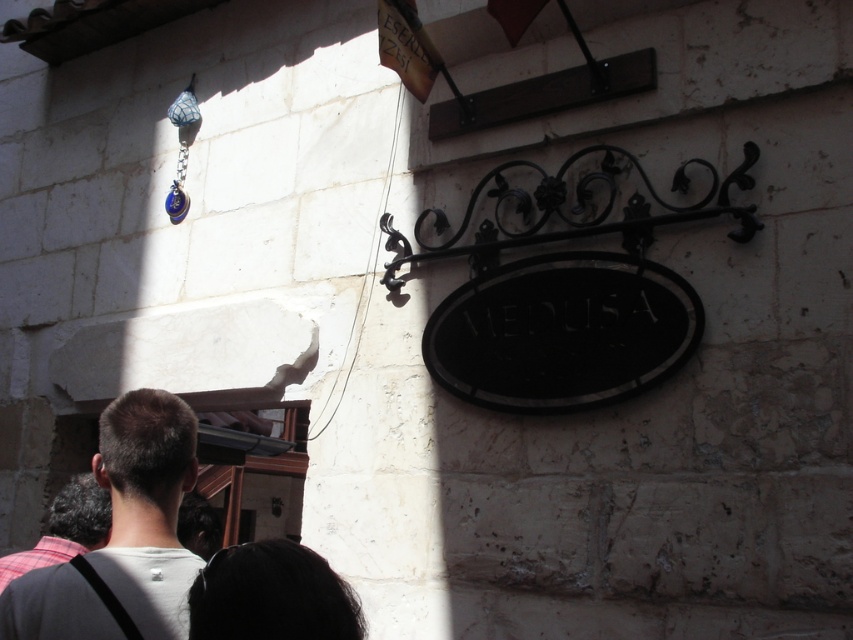
You are an artist observing the building exterior and want to paint the scene. You have two shirts in your bag, the white matte shirt at lower left and the plaid fabric shirt at lower left. Which shirt should you choose to wear if you want to cover more of your body?

The white matte shirt at lower left is larger in size than the plaid fabric shirt at lower left, so you should choose the white matte shirt at lower left to cover more of your body.

You are a photographer taking a portrait of a person standing in front of the building wall. You notice the black hair at lower center and plaid fabric shirt at lower left in your frame. Which of these two items should you adjust to ensure they are both clearly visible in the photo?

The black hair at lower center has a smaller size compared to plaid fabric shirt at lower left, so you should adjust the focus or framing to ensure the smaller black hair at lower center is clearly visible.

You are a photographer taking a portrait of a person standing in front of the building wall. You notice the white matte shirt at lower left and the black hair at lower center in your frame. Which object is closer to the left edge of the photo?

The white matte shirt at lower left is closer to the left edge of the photo because it is positioned on the left side of the black hair at lower center.